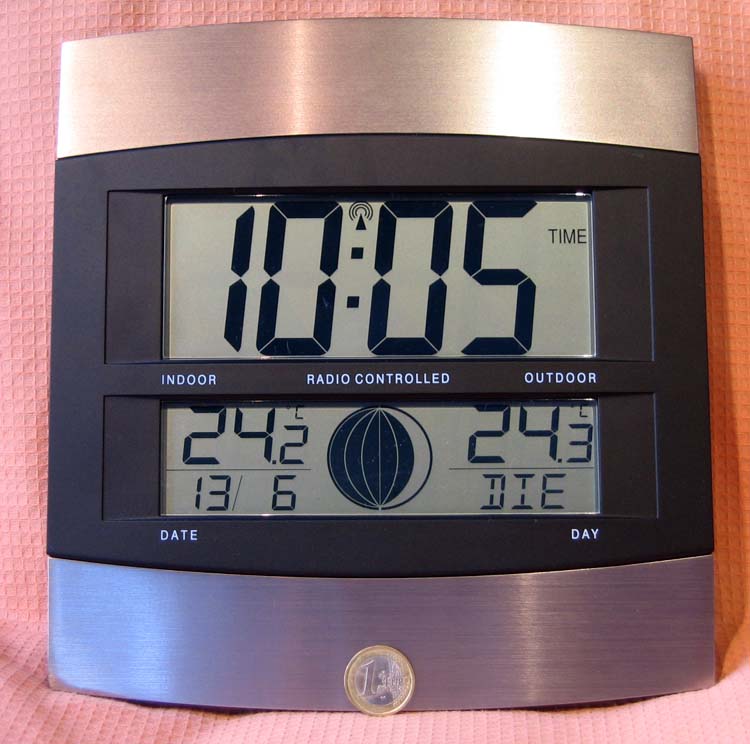
Locate an element on the screen. Image resolution: width=750 pixels, height=744 pixels. pink waffle texture fabric is located at coordinates (32, 727).